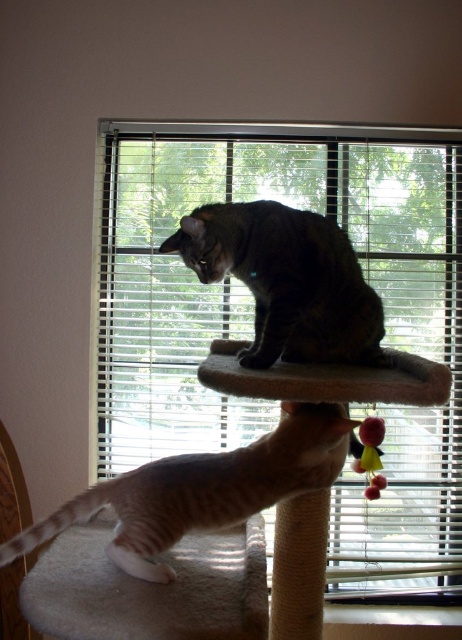
Where is `dark gray fur cat at center`? dark gray fur cat at center is located at coordinates (287, 282).

Between point (200, 216) and point (169, 568), which one is positioned in front?

Point (169, 568) is more forward.

Between point (368, 332) and point (321, 456), which one is positioned in front?

Point (321, 456) is in front.

I want to click on dark gray fur cat at center, so click(x=287, y=282).

How much distance is there between beige carpeted stool at center and dark gray fur cat at center?

beige carpeted stool at center is 23.83 centimeters from dark gray fur cat at center.

Can you confirm if beige carpeted stool at center is wider than dark gray fur cat at center?

Yes.

What do you see at coordinates (348, 470) in the screenshot? Image resolution: width=462 pixels, height=640 pixels. I see `beige carpeted stool at center` at bounding box center [348, 470].

This screenshot has width=462, height=640. I want to click on beige carpeted stool at center, so click(x=348, y=470).

The width and height of the screenshot is (462, 640). What do you see at coordinates (253, 316) in the screenshot? I see `white blinds at center` at bounding box center [253, 316].

Which is behind, point (257, 163) or point (295, 436)?

Positioned behind is point (257, 163).

I want to click on white blinds at center, so click(253, 316).